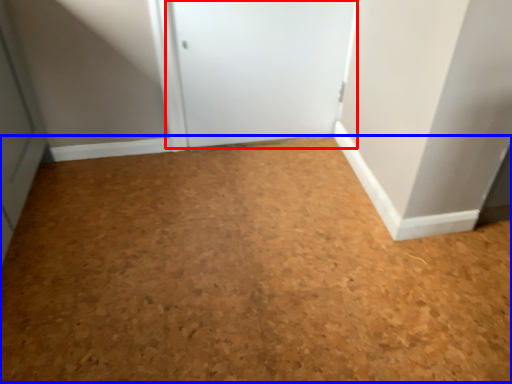
Question: Which object is closer to the camera taking this photo, door (highlighted by a red box) or plain (highlighted by a blue box)?

Choices:
 (A) door
 (B) plain

Answer: (B)